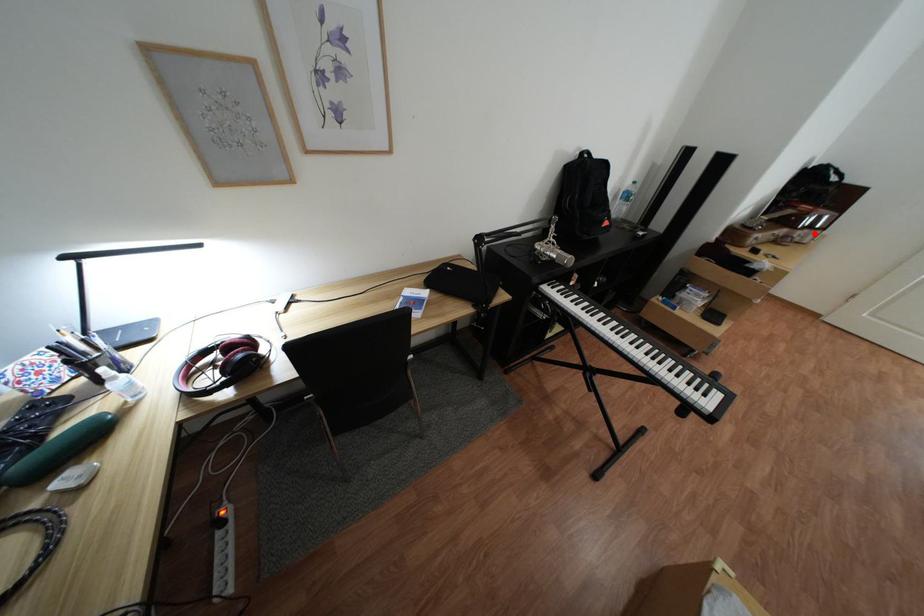
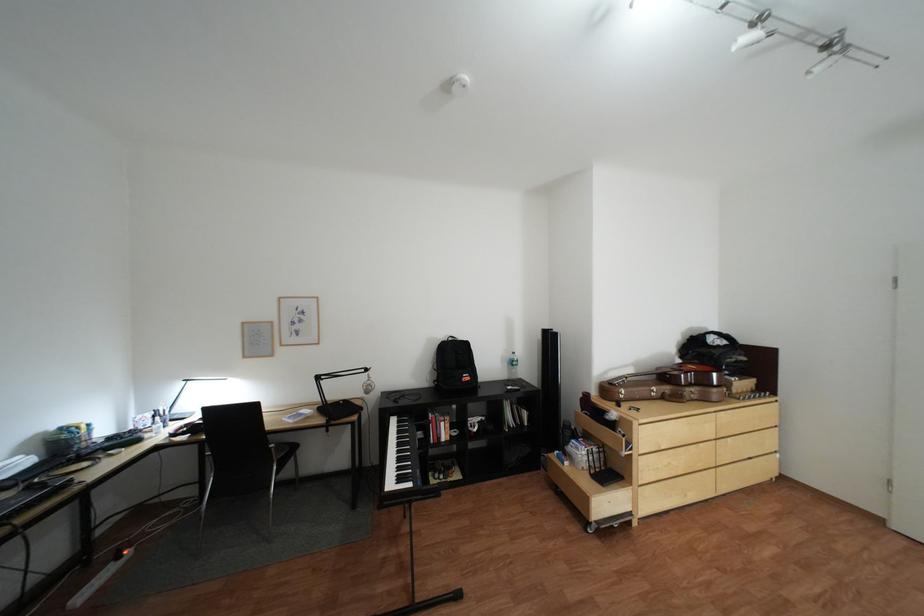
The point at the highlighted location is marked in the first image. Where is the corresponding point in the second image?

(703, 391)